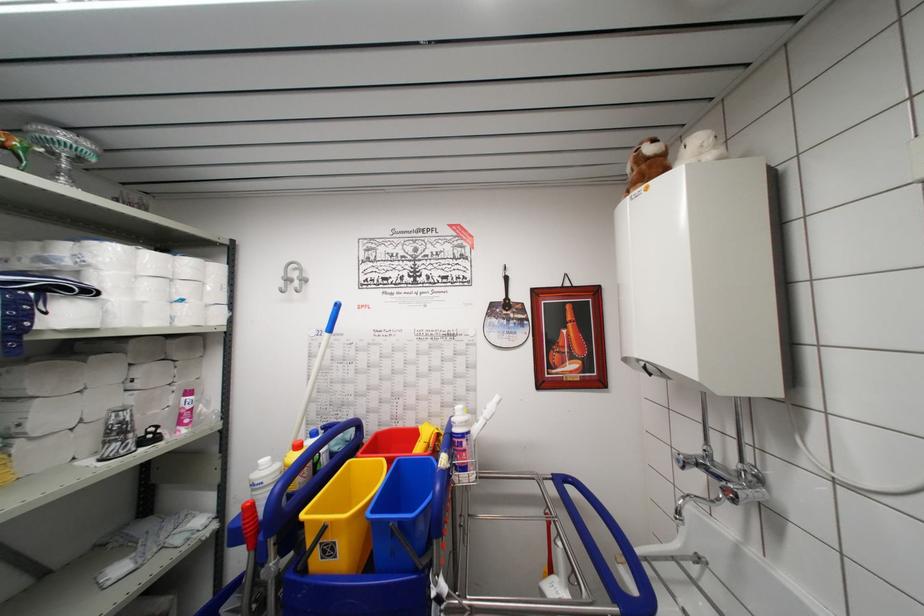
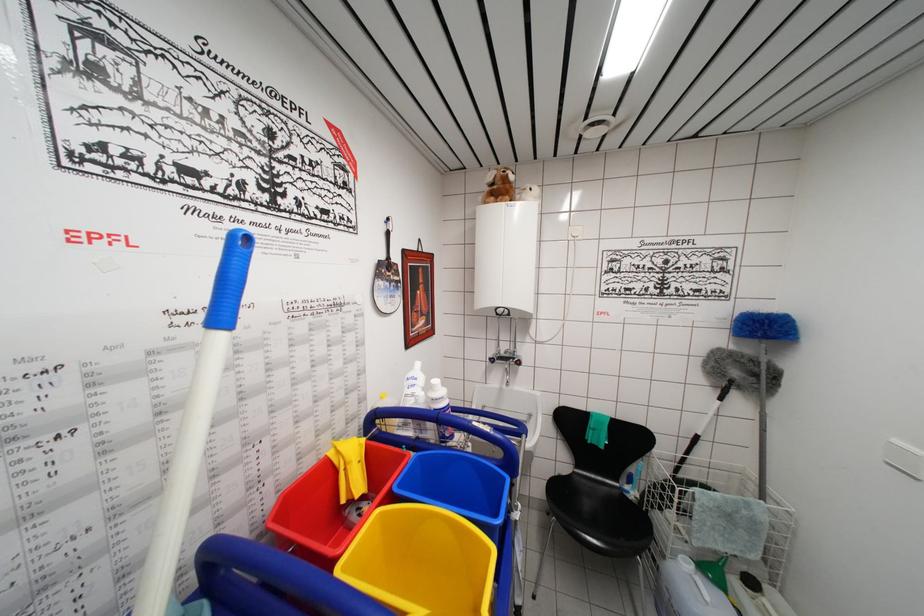
Question: The camera is either moving clockwise (left) or counter-clockwise (right) around the object. The first image is from the beginning of the video and the second image is from the end. Is the camera moving left or right when shooting the video?

Choices:
 (A) Left
 (B) Right

Answer: (A)